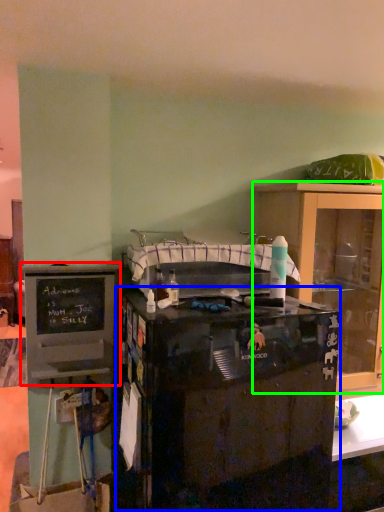
Question: Estimate the real-world distances between objects in this image. Which object is farther from cabinetry (highlighted by a red box), desk (highlighted by a blue box) or cabinetry (highlighted by a green box)?

Choices:
 (A) desk
 (B) cabinetry

Answer: (B)